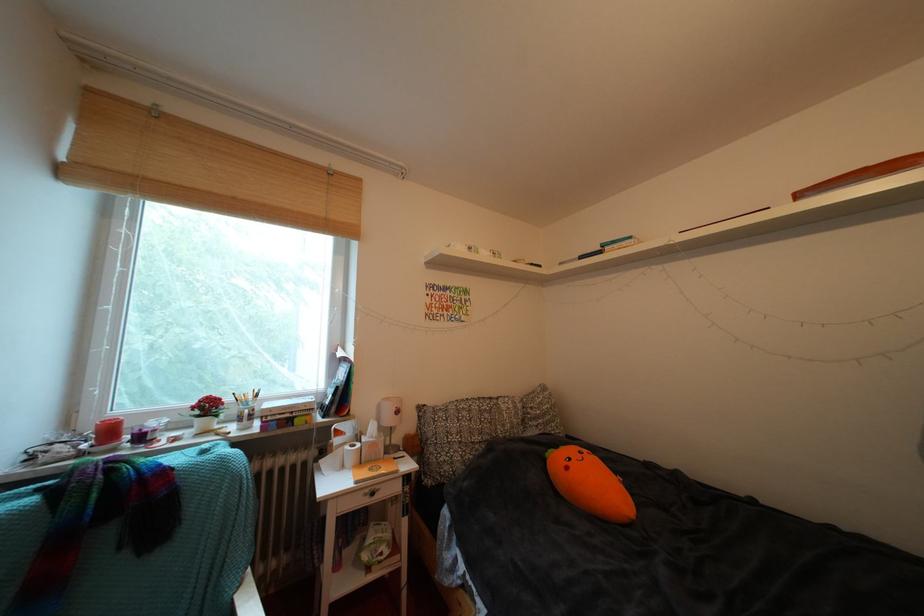
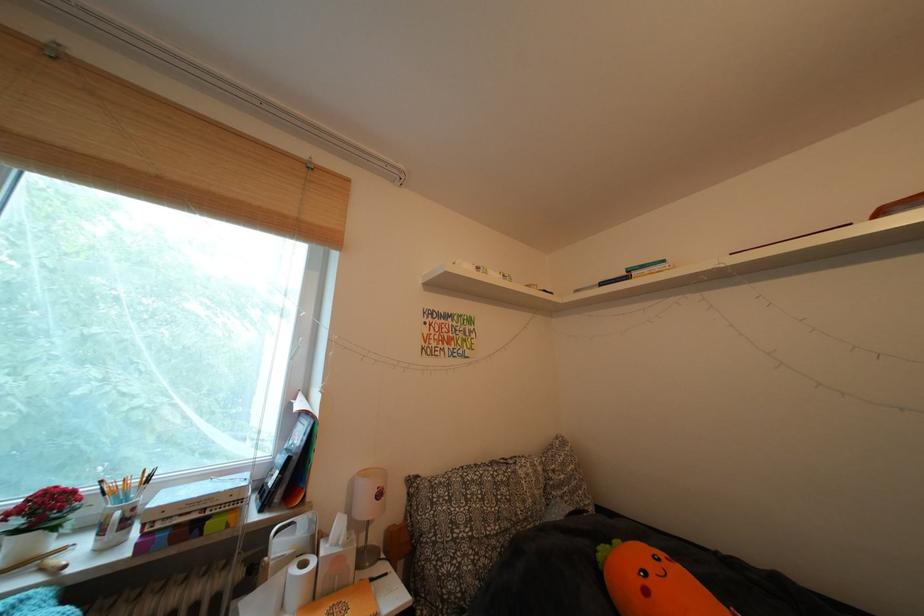
Find the pixel in the second image that matches (257,416) in the first image.

(128, 519)